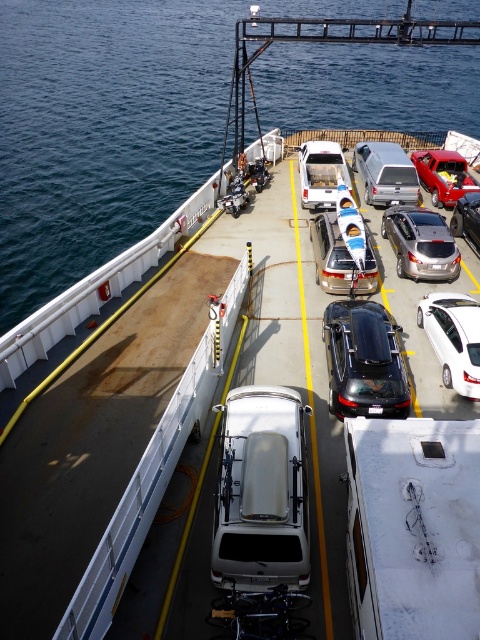
Which is below, satin silver suv at center or metallic silver car at center?

Positioned lower is metallic silver car at center.

Is satin silver suv at center above metallic silver car at center?

Correct, satin silver suv at center is located above metallic silver car at center.

Does point (432, 278) lie in front of point (338, 234)?

Yes, it is.

Where is `satin silver suv at center`? This screenshot has width=480, height=640. satin silver suv at center is located at coordinates (420, 243).

Which is below, white matte van at center or metallic silver car at center?

Positioned lower is white matte van at center.

Find the location of `white matte van at center`. white matte van at center is located at coordinates (262, 492).

Describe the element at coordinates (420, 243) in the screenshot. I see `satin silver suv at center` at that location.

Can you confirm if satin silver suv at center is thinner than matte black car at center?

No.

Which is in front, point (443, 232) or point (314, 160)?

Point (443, 232) is in front.

You are a GUI agent. You are given a task and a screenshot of the screen. Output one action in this format:
    pyautogui.click(x=<x>, y=<y>)
    Task: Click on the satin silver suv at center
    This screenshot has height=640, width=480.
    Given the screenshot: What is the action you would take?
    pyautogui.click(x=420, y=243)